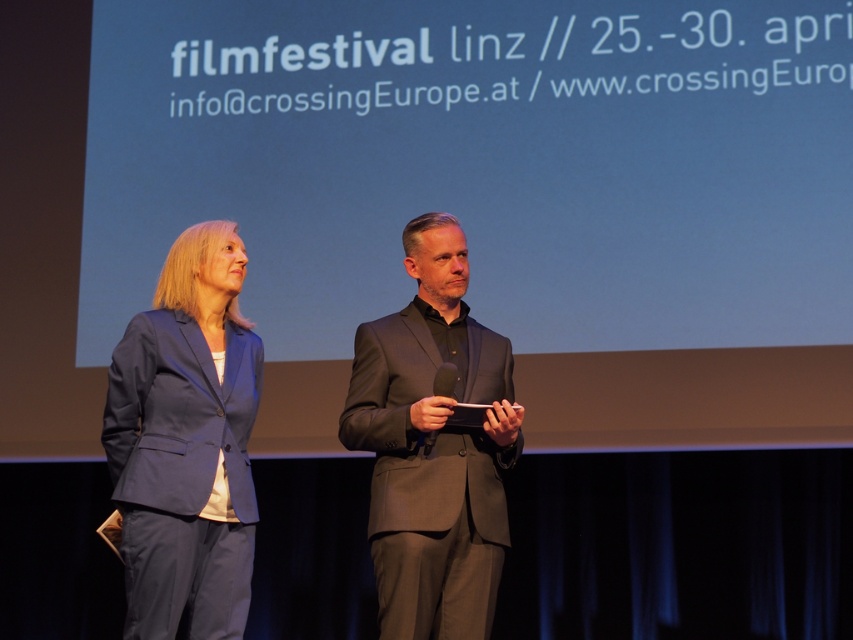
You are a photographer at the film festival. You need to position a camera stand between the matte blue suit at left and the matte black suit at center so that both are in frame. Given that the camera stand requires 1.2 meters of space between the two suits to capture them fully, is this possible?

The matte blue suit at left is not as tall as the matte black suit at center, but the question is about the distance between them. Since the description does not provide information about the distance between the two suits, it is impossible to determine if the 1.2 meters of space is available. Please check the actual distance between the two suits.

You are a photographer positioned at the back of the stage. You need to take a clear photo of both the matte blue suit at left and the matte black suit at center. Which suit will appear larger in your photo?

The matte blue suit at left will appear larger in the photo because it is closer to the viewer than the matte black suit at center.